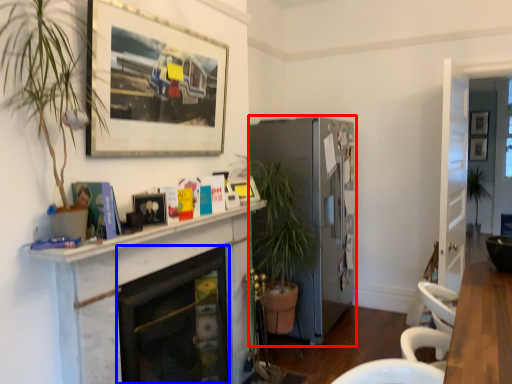
Question: Which point is closer to the camera, fireplace (highlighted by a red box) or fireplace (highlighted by a blue box)?

Choices:
 (A) fireplace
 (B) fireplace

Answer: (B)